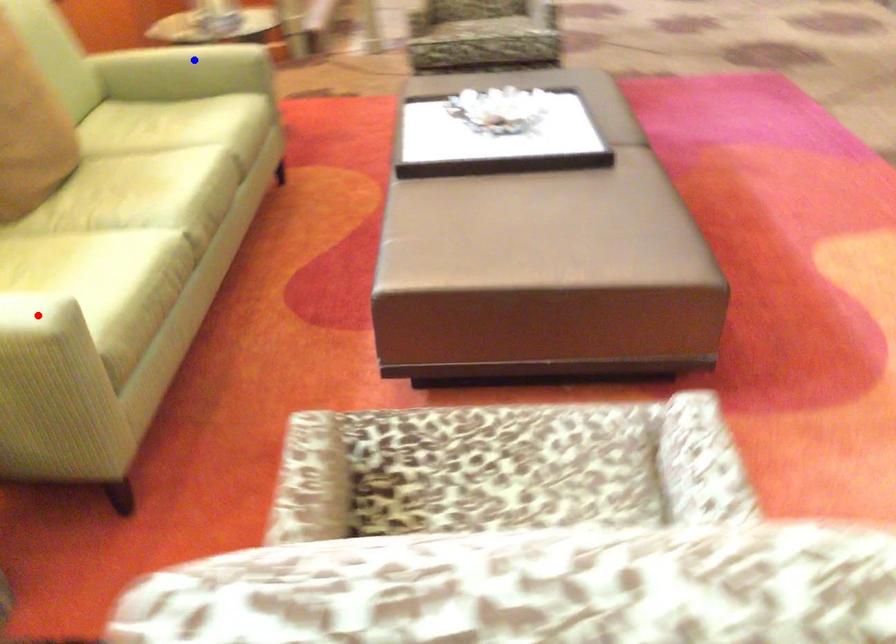
Question: In the image, two points are highlighted. Which point is nearer to the camera? Reply with the corresponding letter.

Choices:
 (A) blue point
 (B) red point

Answer: (B)